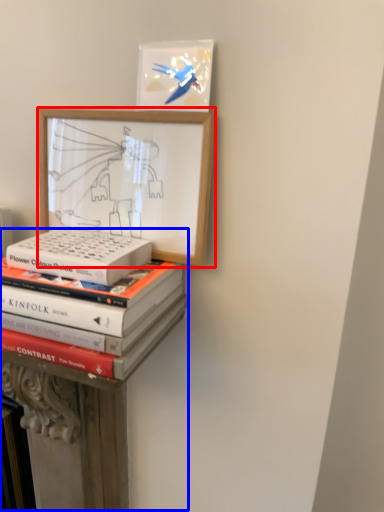
Question: Which object appears farthest to the camera in this image, picture frame (highlighted by a red box) or bookshelf (highlighted by a blue box)?

Choices:
 (A) picture frame
 (B) bookshelf

Answer: (B)